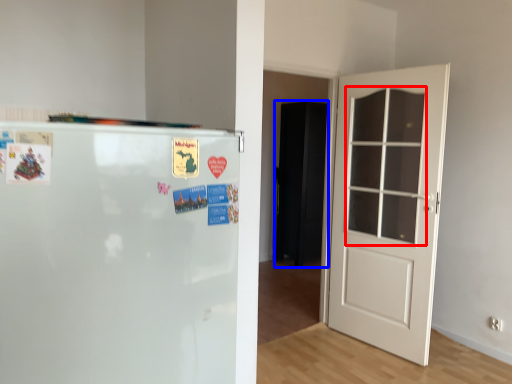
Question: Which of the following is the closest to the observer, window (highlighted by a red box) or armoire (highlighted by a blue box)?

Choices:
 (A) window
 (B) armoire

Answer: (A)